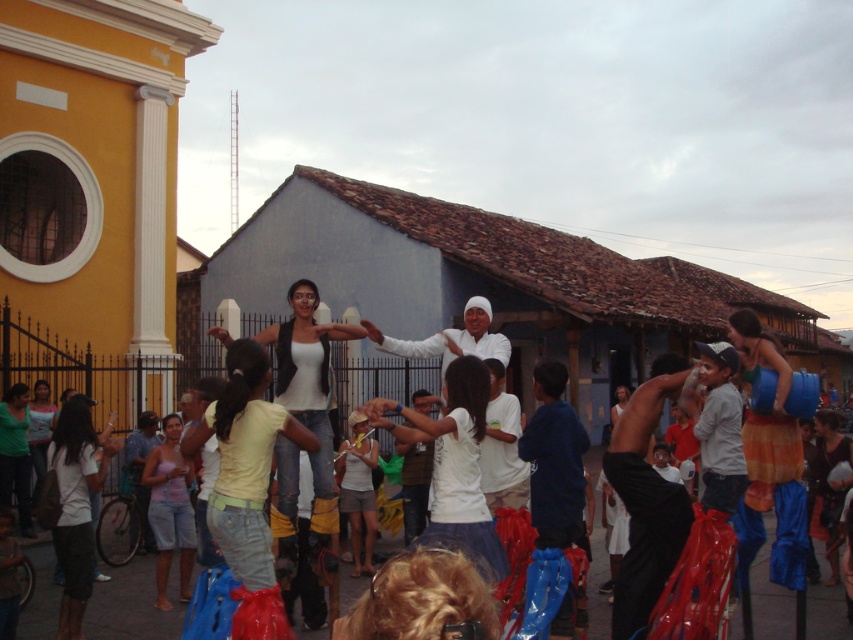
Question: In this image, where is white cotton shirt at center located relative to matte green shirt at lower left?

Choices:
 (A) right
 (B) left

Answer: (A)

Question: Based on their relative distances, which object is nearer to the light purple fabric shirt at lower left?

Choices:
 (A) white cotton shirt at lower left
 (B) white matte tank top at center
 (C) blue fabric skirt at right

Answer: (A)

Question: Which point appears farthest from the camera in this image?

Choices:
 (A) (779, 477)
 (B) (224, 456)

Answer: (A)

Question: Is white matte tank top at center to the right of light purple fabric shirt at lower left from the viewer's perspective?

Choices:
 (A) no
 (B) yes

Answer: (B)

Question: Is white cotton shirt at center thinner than light purple fabric shirt at lower left?

Choices:
 (A) no
 (B) yes

Answer: (A)

Question: Which point appears farthest from the camera in this image?

Choices:
 (A) (796, 512)
 (B) (299, 408)
 (C) (445, 508)
 (D) (61, 422)

Answer: (B)